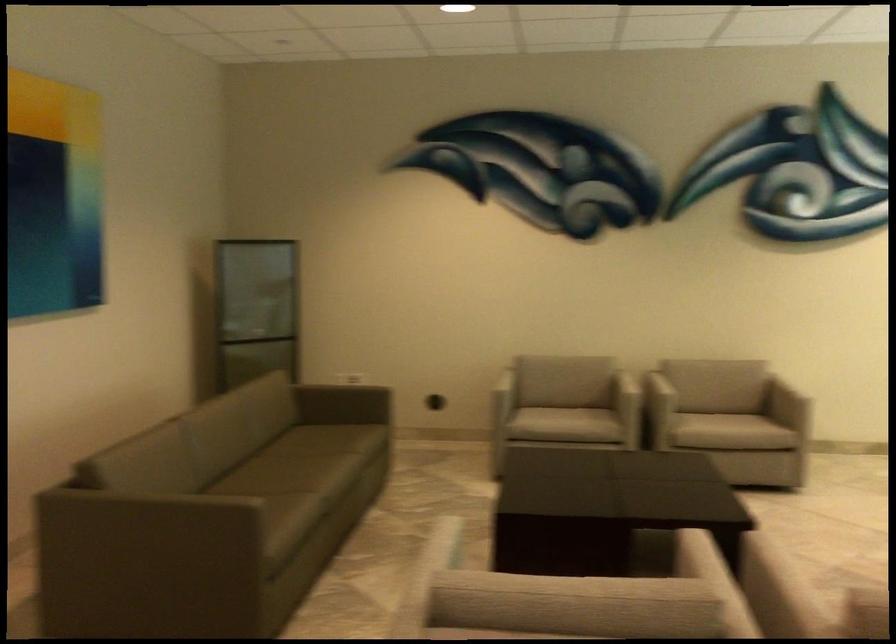
The height and width of the screenshot is (644, 896). What do you see at coordinates (290, 462) in the screenshot?
I see `the brown sofa sitting surface` at bounding box center [290, 462].